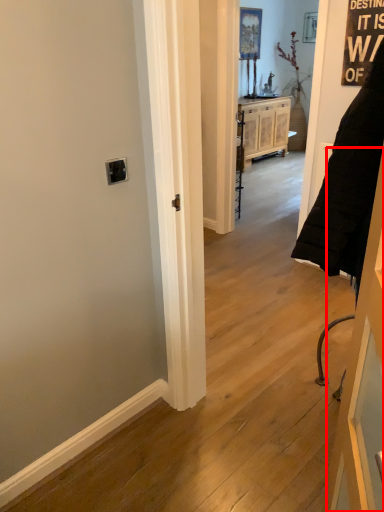
Question: Considering the relative positions of door (annotated by the red box) and cabinetry in the image provided, where is door (annotated by the red box) located with respect to the staircase?

Choices:
 (A) left
 (B) right

Answer: (A)